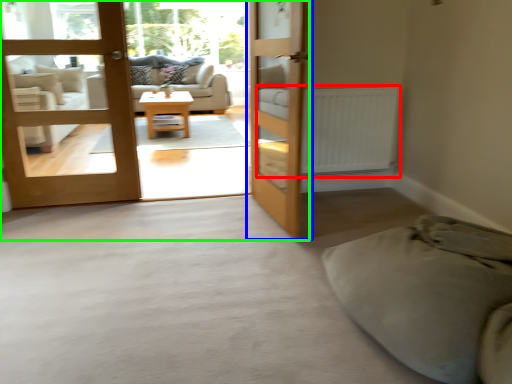
Question: Which object is positioned closest to radiator (highlighted by a red box)? Select from door (highlighted by a blue box) and bunk bed (highlighted by a green box).

Choices:
 (A) door
 (B) bunk bed

Answer: (A)